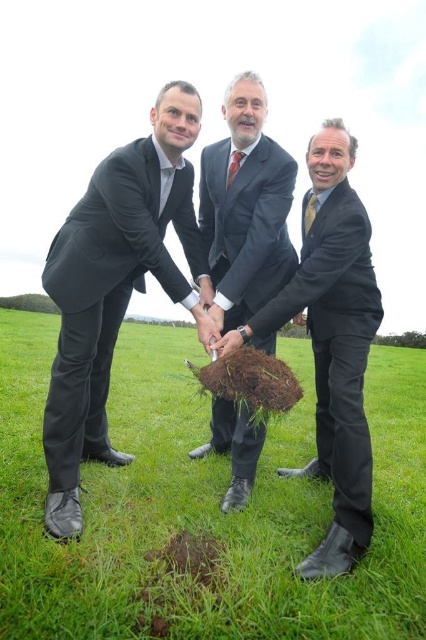
Between green grass at center and black suit at center, which one is positioned lower?

green grass at center is lower down.

Which is behind, point (111, 502) or point (325, 410)?

Point (325, 410)

Locate an element on the screen. Image resolution: width=426 pixels, height=640 pixels. green grass at center is located at coordinates (203, 506).

Find the location of a particular element. The width and height of the screenshot is (426, 640). green grass at center is located at coordinates (203, 506).

Who is positioned more to the left, black matte suit at left or black suit at center?

Positioned to the left is black matte suit at left.

Is point (127, 284) in front of point (359, 241)?

No.

Does point (135, 172) lie behind point (331, 204)?

No, it is in front of (331, 204).

At what (x,y) coordinates should I click in order to perform the action: click on black matte suit at left. Please return your answer as a coordinate pair (x, y). This screenshot has height=640, width=426. Looking at the image, I should click on (115, 288).

Can you confirm if black matte suit at left is taller than green leafy tree at center?

Yes.

Which is in front, point (81, 292) or point (400, 346)?

Point (81, 292) is more forward.

What are the coordinates of `black matte suit at left` in the screenshot? It's located at (115, 288).

You are a GUI agent. You are given a task and a screenshot of the screen. Output one action in this format:
    pyautogui.click(x=<x>, y=<y>)
    Task: Click on the black matte suit at left
    The image size is (426, 640).
    Given the screenshot: What is the action you would take?
    pyautogui.click(x=115, y=288)